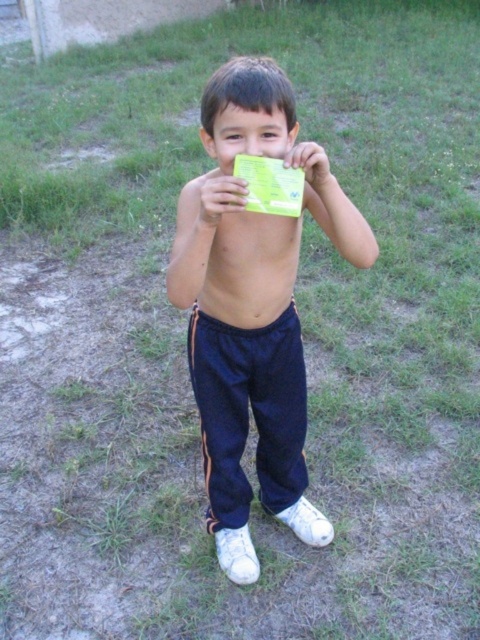
You are a photographer trying to capture a clear shot of the child in the image. The child is holding a card that covers their face. Since the navy blue track pants at center and smooth skin face at center are 19.10 inches apart, can you adjust your angle to see the face without the card?

The distance between the navy blue track pants at center and smooth skin face at center is 19.10 inches. Since the card is held in front of the face, adjusting the angle could allow you to see the face if the photographer positions themselves so the card doesn not block the view, but the distance between the pants and face suggests the card is close to the face, making it challenging.

The child is holding a card in front of their face. Considering the position of the navy blue track pants at center and the smooth skin face at center, which object is closer to the ground?

The navy blue track pants at center is closer to the ground because it is positioned below the smooth skin face at center.

Based on the scene description, can you determine if the navy blue track pants at center are wider than the smooth skin face at center?

The navy blue track pants at center might be wider than smooth skin face at center according to the objects description.